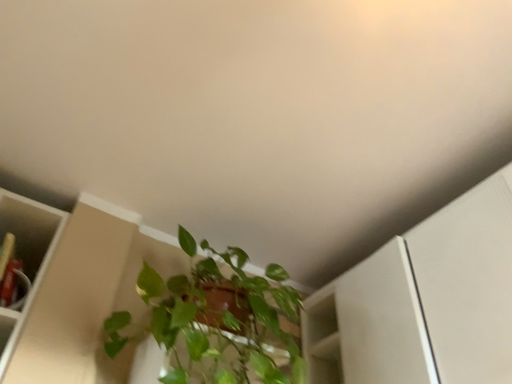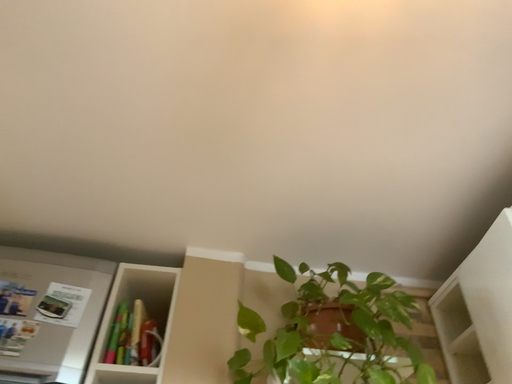
Question: How did the camera likely rotate when shooting the video?

Choices:
 (A) rotated left
 (B) rotated right

Answer: (A)